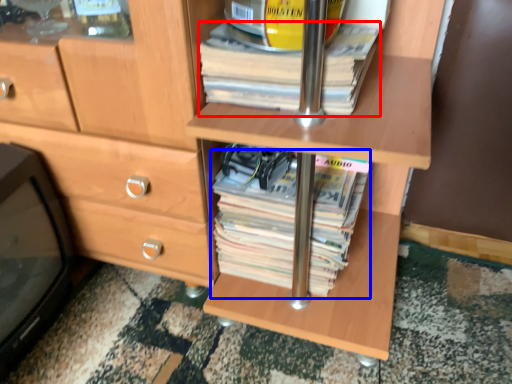
Question: Which of the following is the closest to the observer, paperback book (highlighted by a red box) or paperback book (highlighted by a blue box)?

Choices:
 (A) paperback book
 (B) paperback book

Answer: (A)